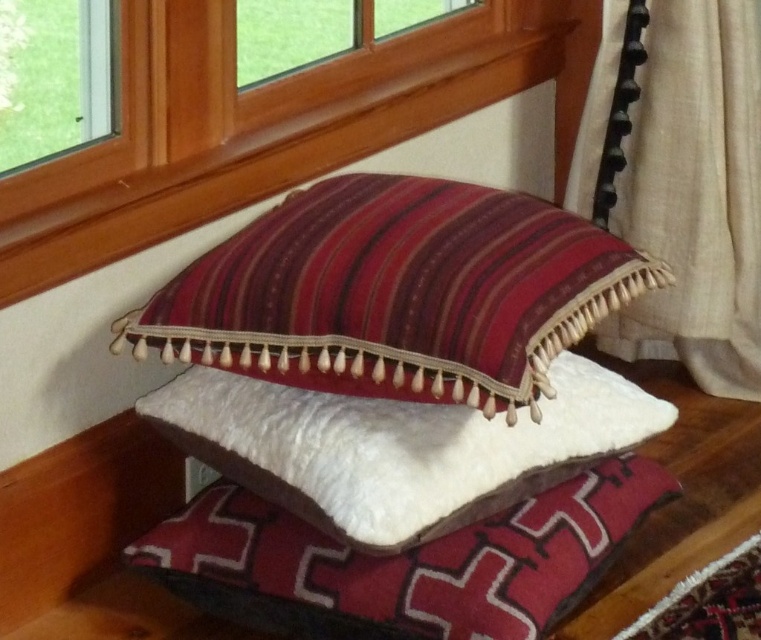
Is wooden frame at upper center in front of white soft pillow at center?

No, it is not.

Between wooden frame at upper center and white soft pillow at center, which one appears on the right side from the viewer's perspective?

Positioned to the right is white soft pillow at center.

You are a GUI agent. You are given a task and a screenshot of the screen. Output one action in this format:
    pyautogui.click(x=<x>, y=<y>)
    Task: Click on the wooden frame at upper center
    The width and height of the screenshot is (761, 640).
    Given the screenshot: What is the action you would take?
    pyautogui.click(x=266, y=124)

Does striped velvet cushion at center have a greater width compared to wooden frame at upper center?

No.

Which is behind, point (403, 353) or point (68, 212)?

The point (68, 212) is behind.

Find the location of a particular element. This screenshot has width=761, height=640. striped velvet cushion at center is located at coordinates (396, 292).

Is the position of striped velvet cushion at center more distant than that of beige fabric curtain at right?

No, striped velvet cushion at center is closer to the viewer.

Does striped velvet cushion at center appear under beige fabric curtain at right?

Yes.

Who is more forward, (x=139, y=324) or (x=586, y=157)?

Positioned in front is point (x=139, y=324).

Find the location of `striped velvet cushion at center`. striped velvet cushion at center is located at coordinates (396, 292).